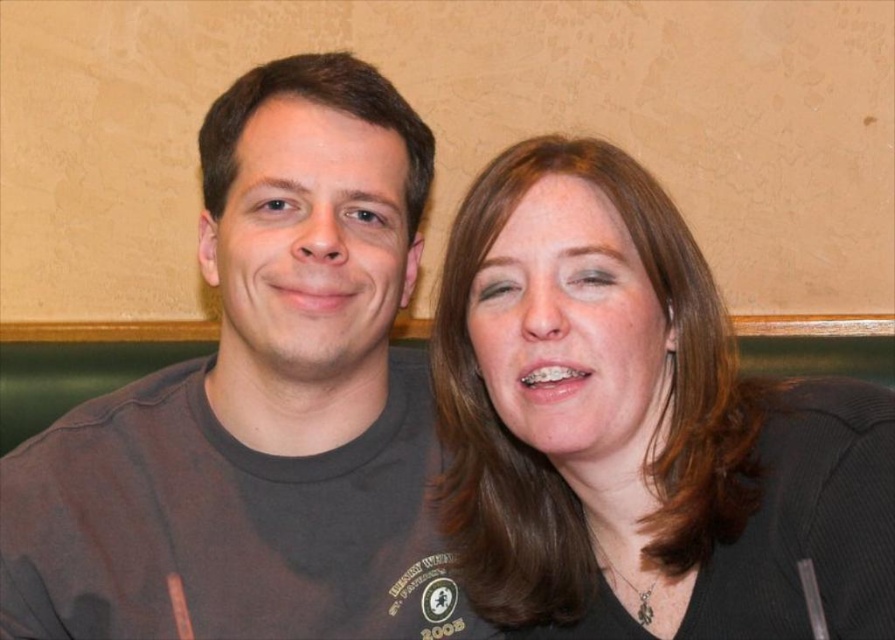
Is dark gray t-shirt at left taller than brown hair at upper right?

Correct, dark gray t-shirt at left is much taller as brown hair at upper right.

Find the location of a particular element. The image size is (895, 640). dark gray t-shirt at left is located at coordinates (260, 404).

Does point (395, 412) come in front of point (497, 272)?

That is False.

Identify the location of dark gray t-shirt at left. Image resolution: width=895 pixels, height=640 pixels. point(260,404).